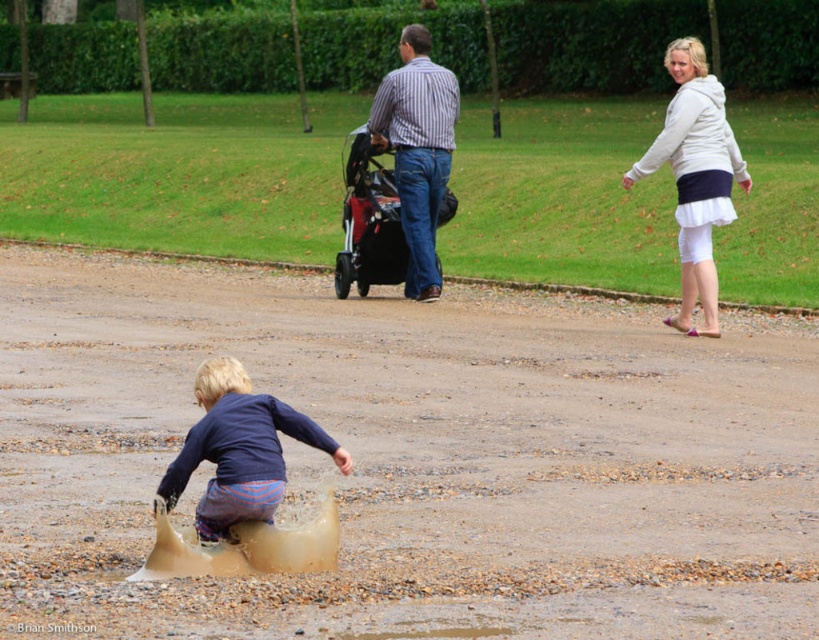
Question: Can you confirm if brown gravel dirt track at lower center is wider than white matte skirt at upper right?

Choices:
 (A) yes
 (B) no

Answer: (A)

Question: Among these points, which one is farthest from the camera?

Choices:
 (A) (382, 212)
 (B) (274, 509)

Answer: (A)

Question: Considering the relative positions of brown gravel dirt track at lower center and smooth concrete path at center in the image provided, where is brown gravel dirt track at lower center located with respect to smooth concrete path at center?

Choices:
 (A) below
 (B) above

Answer: (A)

Question: Estimate the real-world distances between objects in this image. Which object is closer to the white matte skirt at upper right?

Choices:
 (A) red plastic baby carriage at center
 (B) smooth concrete path at center
 (C) striped cotton shirt at center
 (D) brown gravel dirt track at lower center

Answer: (C)

Question: Is white matte skirt at upper right bigger than striped cotton shirt at center?

Choices:
 (A) yes
 (B) no

Answer: (A)

Question: Which of the following is the farthest from the observer?

Choices:
 (A) (627, 209)
 (B) (441, 184)
 (C) (213, 408)

Answer: (A)